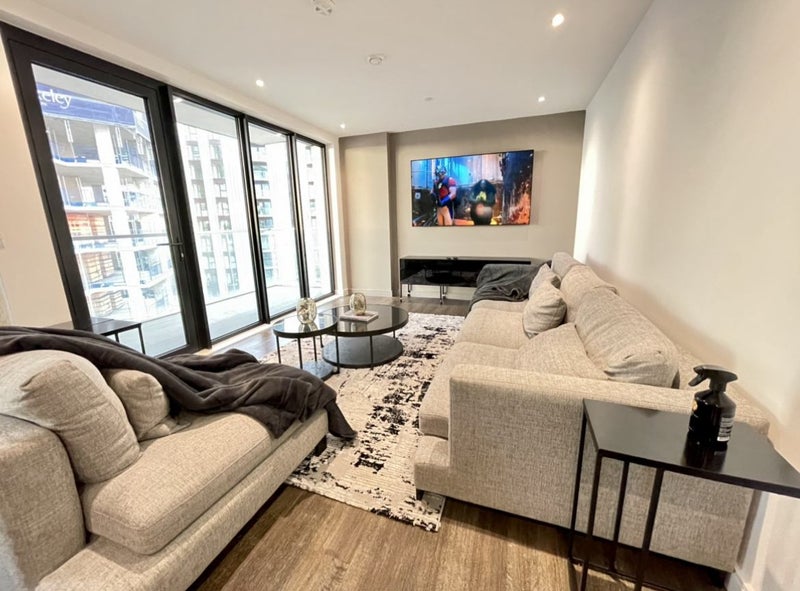
You are a GUI agent. You are given a task and a screenshot of the screen. Output one action in this format:
    pyautogui.click(x=<x>, y=<y>)
    Task: Click on the tv
    The image size is (800, 591).
    Given the screenshot: What is the action you would take?
    pyautogui.click(x=477, y=183)